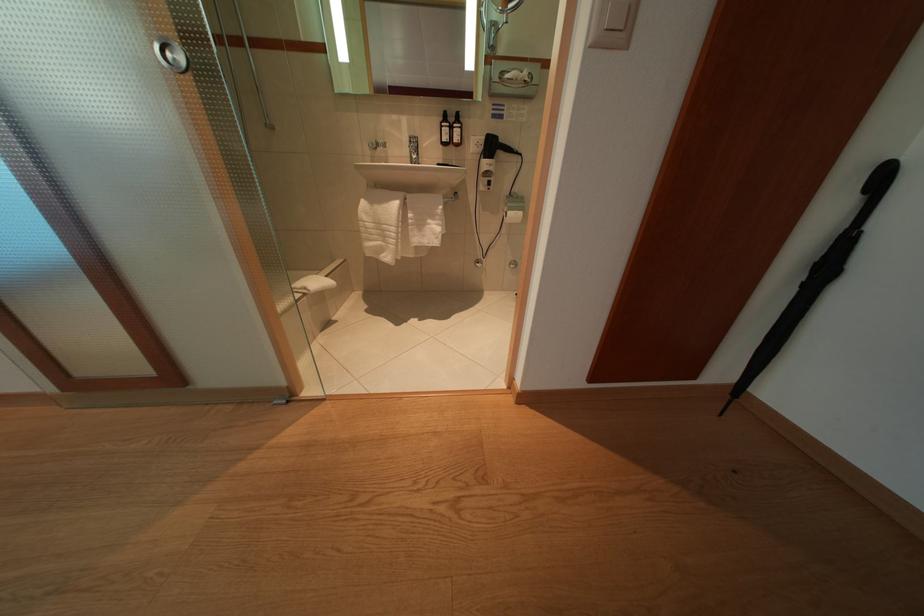
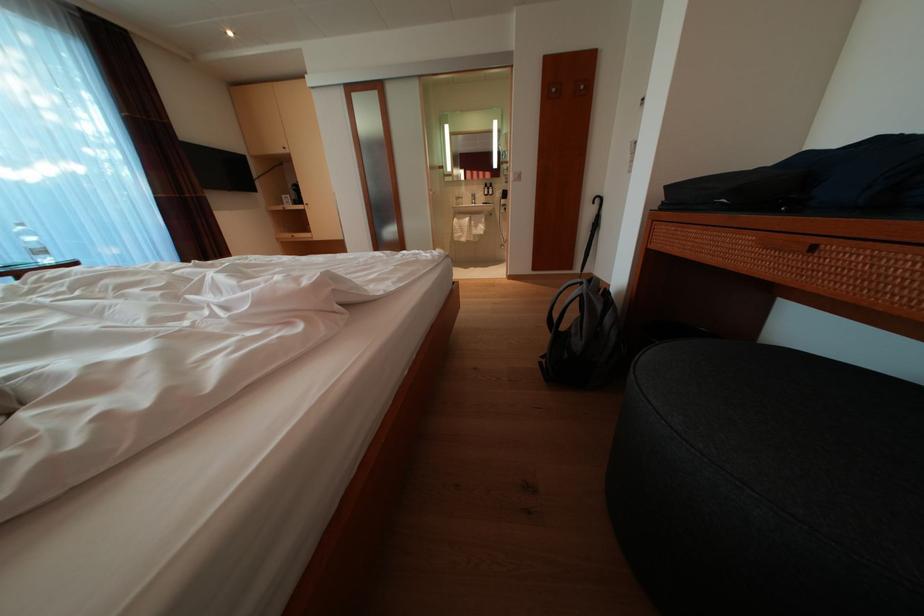
Where in the second image is the point corresponding to the point at 483,150 from the first image?

(506, 200)